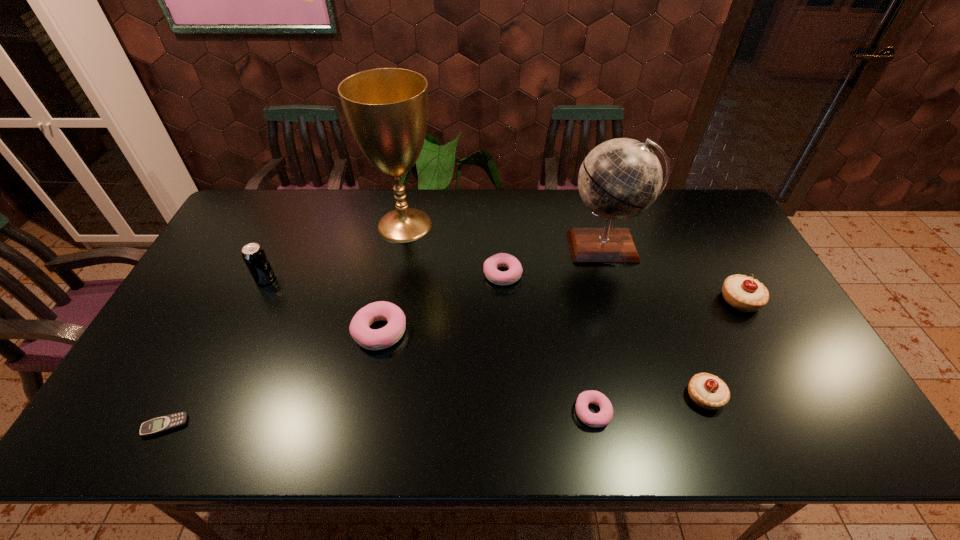
What are the coordinates of `trophy cup` in the screenshot? It's located at (386, 109).

This screenshot has height=540, width=960. In order to click on globe in this screenshot , I will do `click(621, 178)`.

The height and width of the screenshot is (540, 960). I want to click on the seventh shortest object, so click(254, 256).

The height and width of the screenshot is (540, 960). Find the location of `the tallest pastry`. the tallest pastry is located at coordinates (743, 293).

Where is `the bigger beige pastry`? Image resolution: width=960 pixels, height=540 pixels. the bigger beige pastry is located at coordinates (743, 293).

Find the location of a particular element. The height and width of the screenshot is (540, 960). the nearer beige pastry is located at coordinates (708, 391).

Where is `the smaller beige pastry`? the smaller beige pastry is located at coordinates (708, 391).

Where is `the leftmost pastry`? the leftmost pastry is located at coordinates (359, 328).

The height and width of the screenshot is (540, 960). Identify the location of the leftmost pink pastry. (359, 328).

Identify the location of the second pastry from left to right. (491, 264).